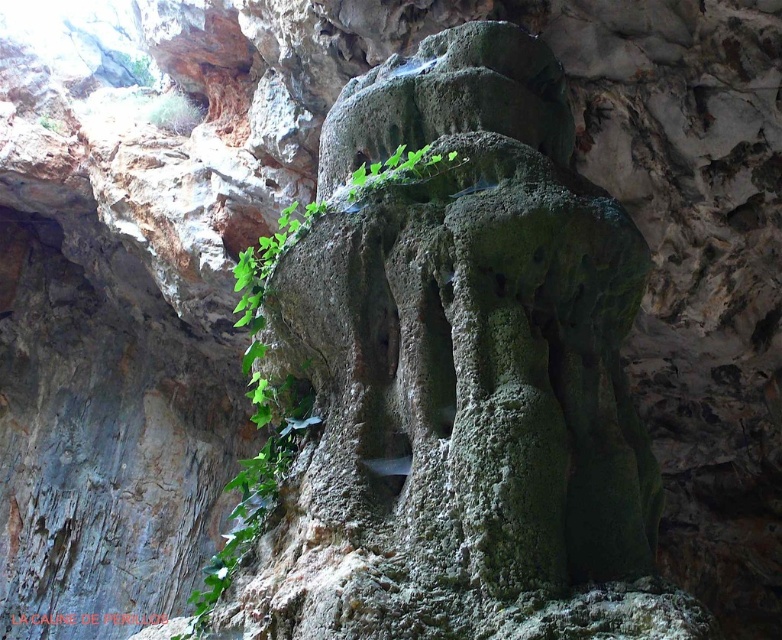
You are a botanist examining the rock formation. You need to collect samples from both the green mossy rock at center and the green leafy plant at center. Which object should you collect first if you want to start from the lowest point?

The green leafy plant at center should be collected first because it is located below the green mossy rock at center.